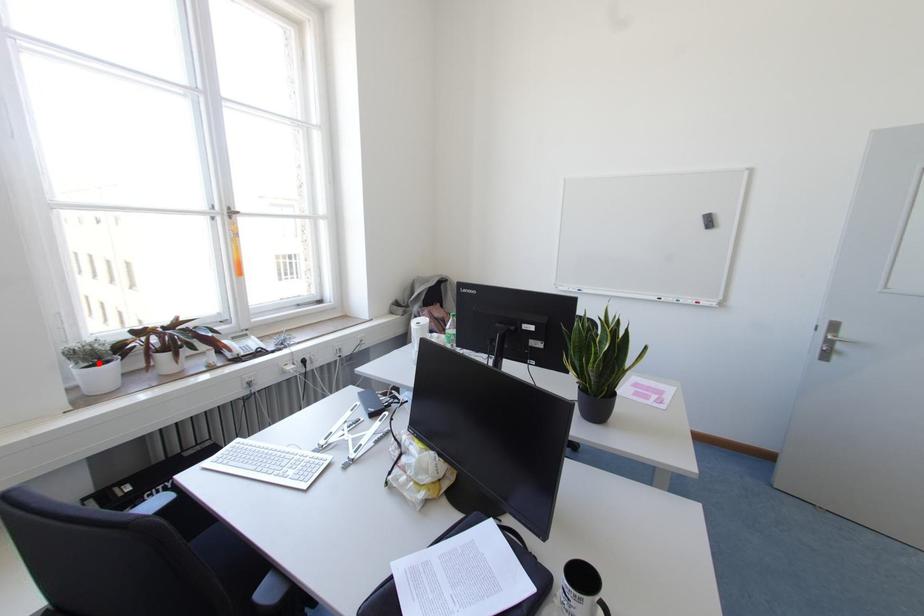
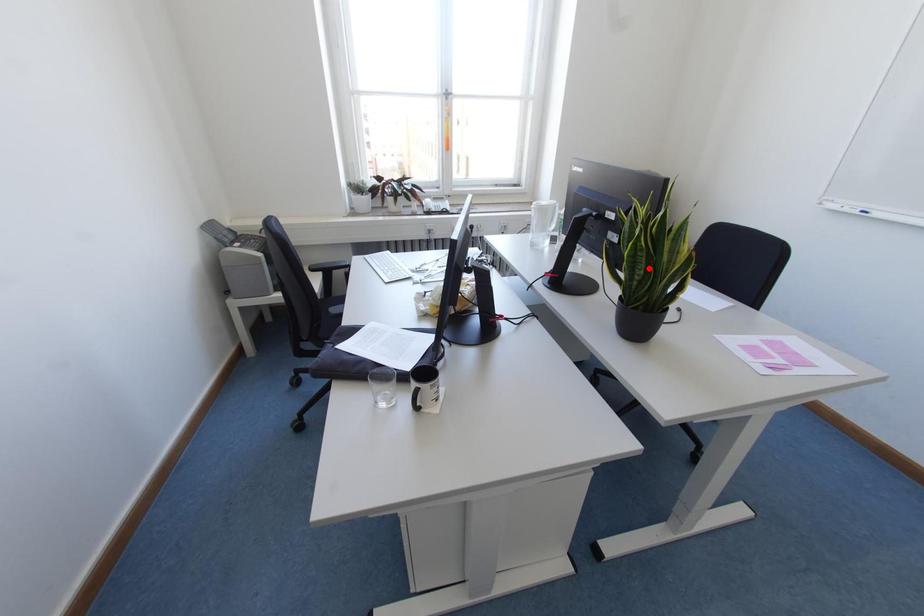
I am providing you with two images of the same scene from different viewpoints. A red point is marked on the first image and another point is marked on the second image. Are the points marked in image1 and image2 representing the same 3D position?

No